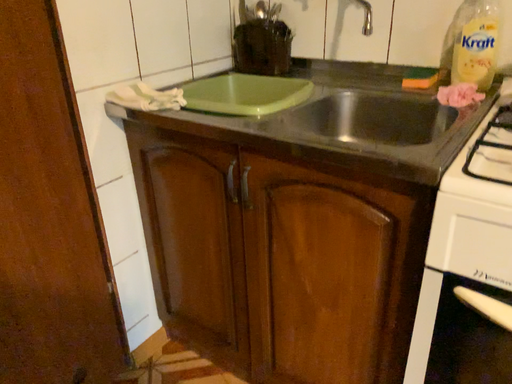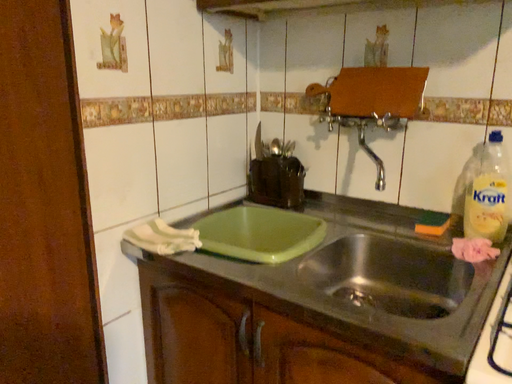
Question: Which way did the camera rotate in the video?

Choices:
 (A) rotated downward
 (B) rotated upward

Answer: (B)